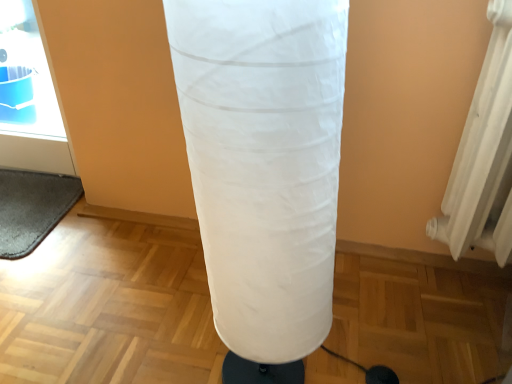
Identify the location of gray fuzzy yoga mat at lower left. (32, 208).

What do you see at coordinates (32, 208) in the screenshot? I see `gray fuzzy yoga mat at lower left` at bounding box center [32, 208].

What is the approximate width of white fabric punching bag at center?

9.14 inches.

Measure the distance between point (x=201, y=184) and camera.

A: 22.17 inches.

The height and width of the screenshot is (384, 512). What do you see at coordinates (264, 162) in the screenshot? I see `white fabric punching bag at center` at bounding box center [264, 162].

At what (x,y) coordinates should I click in order to perform the action: click on white fabric punching bag at center. Please return your answer as a coordinate pair (x, y). The image size is (512, 384). Looking at the image, I should click on (264, 162).

Image resolution: width=512 pixels, height=384 pixels. Find the location of `gray fuzzy yoga mat at lower left`. gray fuzzy yoga mat at lower left is located at coordinates (32, 208).

Considering the relative positions of white fabric punching bag at center and gray fuzzy yoga mat at lower left in the image provided, is white fabric punching bag at center to the left of gray fuzzy yoga mat at lower left from the viewer's perspective?

In fact, white fabric punching bag at center is to the right of gray fuzzy yoga mat at lower left.

Does white fabric punching bag at center lie behind gray fuzzy yoga mat at lower left?

No, white fabric punching bag at center is closer to the viewer.

Which is nearer, (258, 130) or (11, 174)?

Point (258, 130)

From the image's perspective, is white fabric punching bag at center above or below gray fuzzy yoga mat at lower left?

From the image's perspective, white fabric punching bag at center appears below gray fuzzy yoga mat at lower left.

From a real-world perspective, relative to gray fuzzy yoga mat at lower left, is white fabric punching bag at center vertically above or below?

Clearly, from a real-world perspective, white fabric punching bag at center is above gray fuzzy yoga mat at lower left.

Is white fabric punching bag at center wider or thinner than gray fuzzy yoga mat at lower left?

Clearly, white fabric punching bag at center has less width compared to gray fuzzy yoga mat at lower left.

Is white fabric punching bag at center taller than gray fuzzy yoga mat at lower left?

Yes.

Which of these two, white fabric punching bag at center or gray fuzzy yoga mat at lower left, is bigger?

Bigger between the two is white fabric punching bag at center.

Choose the correct answer: Is white fabric punching bag at center inside gray fuzzy yoga mat at lower left or outside it?

white fabric punching bag at center is not enclosed by gray fuzzy yoga mat at lower left.

Would you say white fabric punching bag at center is a long distance from gray fuzzy yoga mat at lower left?

No, white fabric punching bag at center is not far away from gray fuzzy yoga mat at lower left.

Is white fabric punching bag at center aimed at gray fuzzy yoga mat at lower left?

No, white fabric punching bag at center is not aimed at gray fuzzy yoga mat at lower left.

What's the angular difference between white fabric punching bag at center and gray fuzzy yoga mat at lower left's facing directions?

They differ by 2.38 degrees in their facing directions.

How distant is white fabric punching bag at center from gray fuzzy yoga mat at lower left?

white fabric punching bag at center and gray fuzzy yoga mat at lower left are 37.54 inches apart.

What are the coordinates of `punching bag lying in front of the gray fuzzy yoga mat at lower left` in the screenshot? It's located at (264, 162).

Considering the positions of objects gray fuzzy yoga mat at lower left and white fabric punching bag at center in the image provided, who is more to the right, gray fuzzy yoga mat at lower left or white fabric punching bag at center?

Positioned to the right is white fabric punching bag at center.

Is gray fuzzy yoga mat at lower left closer to camera compared to white fabric punching bag at center?

No, gray fuzzy yoga mat at lower left is further to the viewer.

Considering the points (24, 180) and (179, 35), which point is in front, point (24, 180) or point (179, 35)?

The point (179, 35) is closer.

From the image's perspective, is gray fuzzy yoga mat at lower left over white fabric punching bag at center?

Indeed, from the image's perspective, gray fuzzy yoga mat at lower left is shown above white fabric punching bag at center.

From a real-world perspective, is gray fuzzy yoga mat at lower left positioned above or below white fabric punching bag at center?

Answer: From a real-world perspective, gray fuzzy yoga mat at lower left is physically below white fabric punching bag at center.

Which object is wider, gray fuzzy yoga mat at lower left or white fabric punching bag at center?

Wider between the two is gray fuzzy yoga mat at lower left.

In terms of height, does gray fuzzy yoga mat at lower left look taller or shorter compared to white fabric punching bag at center?

Considering their sizes, gray fuzzy yoga mat at lower left has less height than white fabric punching bag at center.

Is gray fuzzy yoga mat at lower left bigger or smaller than white fabric punching bag at center?

A: Clearly, gray fuzzy yoga mat at lower left is smaller in size than white fabric punching bag at center.

Is gray fuzzy yoga mat at lower left spatially inside white fabric punching bag at center, or outside of it?

gray fuzzy yoga mat at lower left is located beyond the bounds of white fabric punching bag at center.

Is gray fuzzy yoga mat at lower left next to white fabric punching bag at center?

gray fuzzy yoga mat at lower left and white fabric punching bag at center are not in contact.

Is gray fuzzy yoga mat at lower left positioned with its back to white fabric punching bag at center?

gray fuzzy yoga mat at lower left is not turned away from white fabric punching bag at center.

Can you tell me how much gray fuzzy yoga mat at lower left and white fabric punching bag at center differ in facing direction?

The angular difference between gray fuzzy yoga mat at lower left and white fabric punching bag at center is 2.38 degrees.

Measure the distance from gray fuzzy yoga mat at lower left to white fabric punching bag at center.

They are 37.54 inches apart.

Locate an element on the screen. punching bag lying below the gray fuzzy yoga mat at lower left (from the image's perspective) is located at coordinates (264, 162).

Where is `punching bag in front of the gray fuzzy yoga mat at lower left`? This screenshot has width=512, height=384. punching bag in front of the gray fuzzy yoga mat at lower left is located at coordinates (264, 162).

Locate an element on the screen. The image size is (512, 384). yoga mat on the left of white fabric punching bag at center is located at coordinates (32, 208).